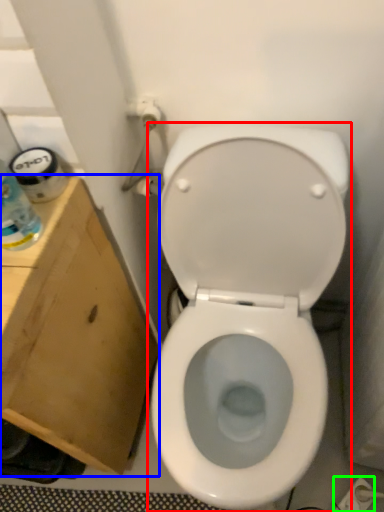
Question: Estimate the real-world distances between objects in this image. Which object is closer to toilet (highlighted by a red box), cardboard box (highlighted by a blue box) or electric outlet (highlighted by a green box)?

Choices:
 (A) cardboard box
 (B) electric outlet

Answer: (A)